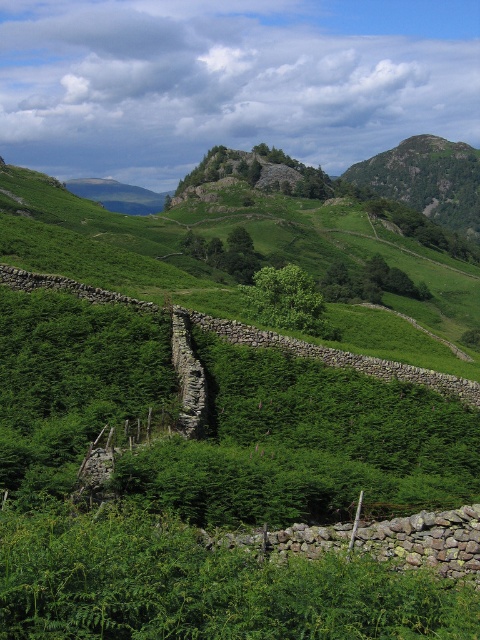
You are standing at the point labeled as point (x=105, y=246) in the image. What is the immediate terrain feature beneath your feet?

The immediate terrain feature beneath your feet at point (x=105, y=246) is the green grassy hillside at center.

You are a hiker planning to take a photo of both the green grassy hillside at center and the rugged rock mountain at upper center. Which object should you stand to the right of to ensure both are visible in your frame?

You should stand to the right of the rugged rock mountain at upper center to ensure both the green grassy hillside at center and the rugged rock mountain at upper center are visible in your frame, as the green grassy hillside at center is positioned to the left of the mountain.